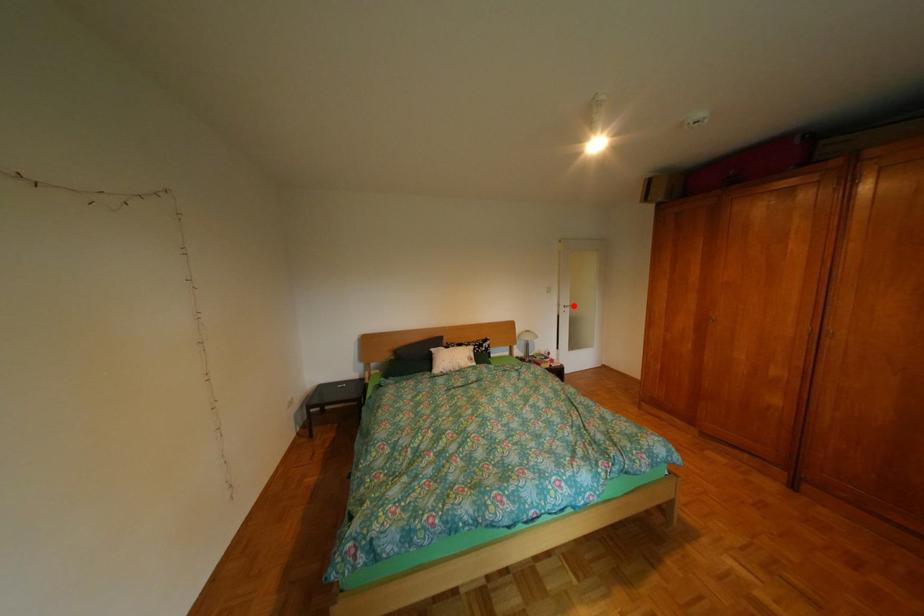
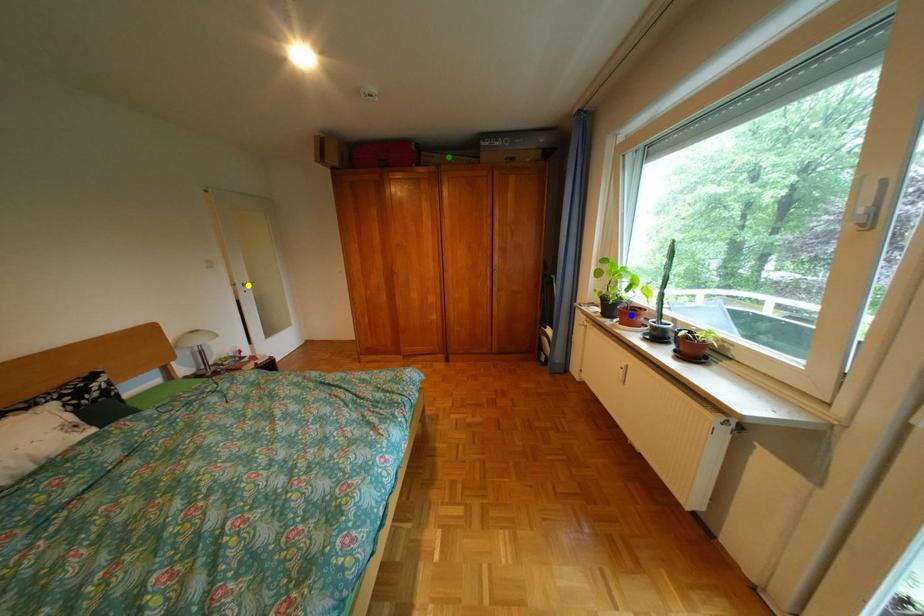
Question: I am providing you with two images of the same scene from different viewpoints. A red point is marked on the first image. You are given multiple points on the second image. Which point in image 2 represents the same 3d spot as the red point in image 1?

Choices:
 (A) green point
 (B) yellow point
 (C) blue point

Answer: (B)